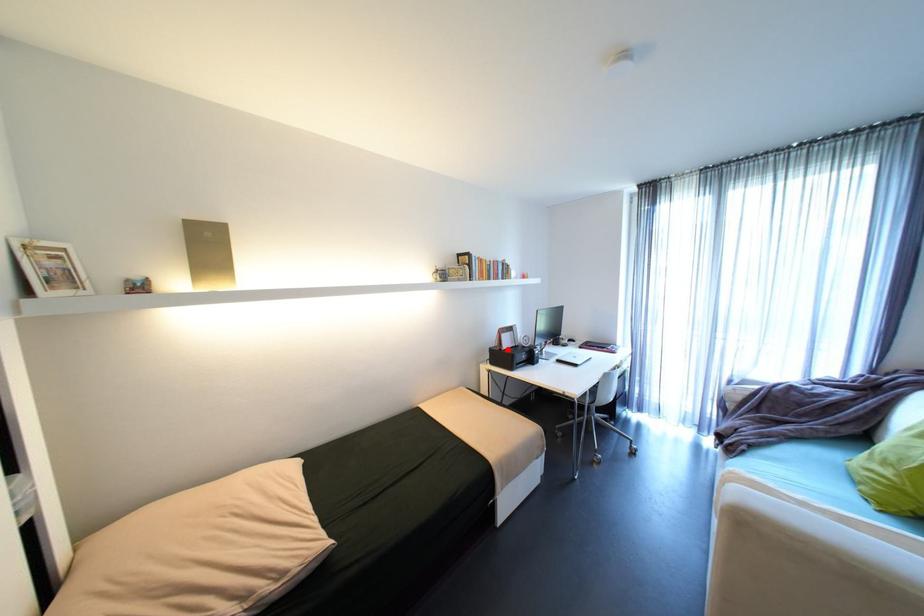
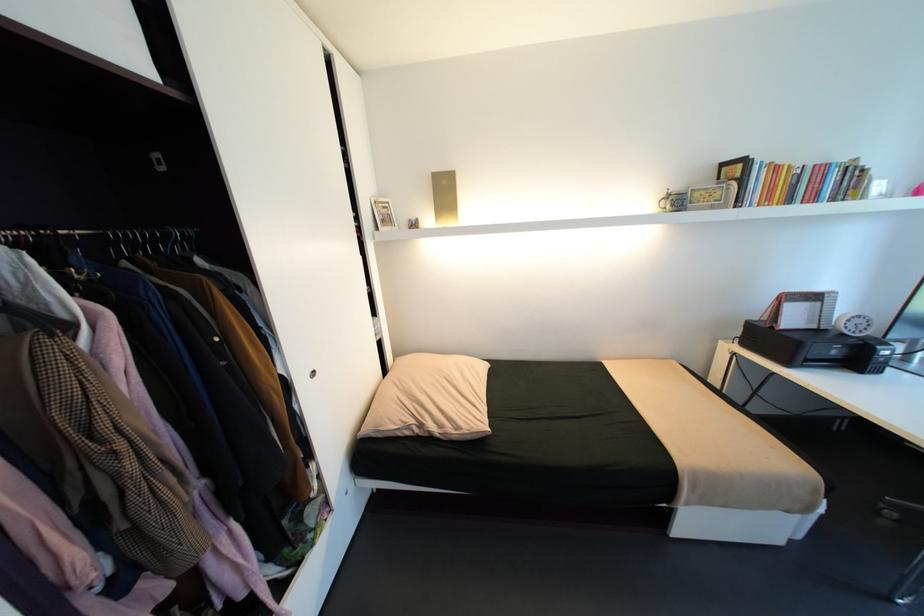
Question: I am providing you with two images of the same scene from different viewpoints. A red point is marked on the first image. Is the red point's position out of view in image 2?

Choices:
 (A) Yes
 (B) No

Answer: (B)